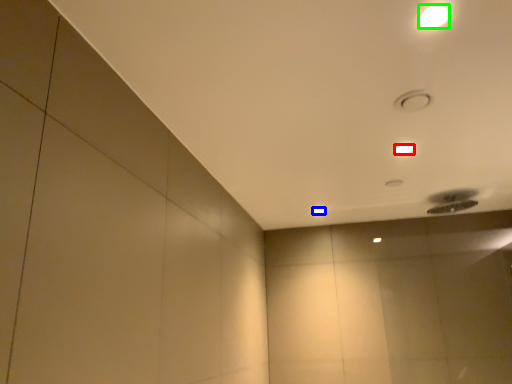
Question: Based on their relative distances, which object is farther from lamp (highlighted by a red box)? Choose from lamp (highlighted by a blue box) and lamp (highlighted by a green box).

Choices:
 (A) lamp
 (B) lamp

Answer: (A)